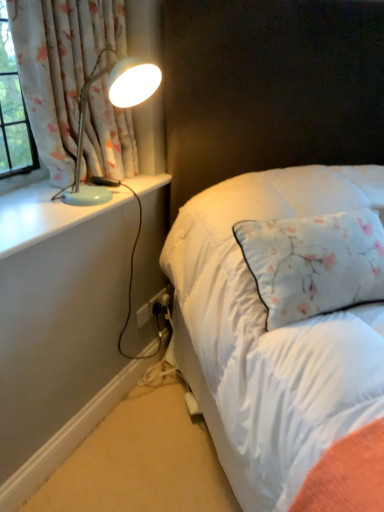
Locate an element on the screen. This screenshot has height=512, width=384. free spot above white glossy window sill at left (from a real-world perspective) is located at coordinates (61, 200).